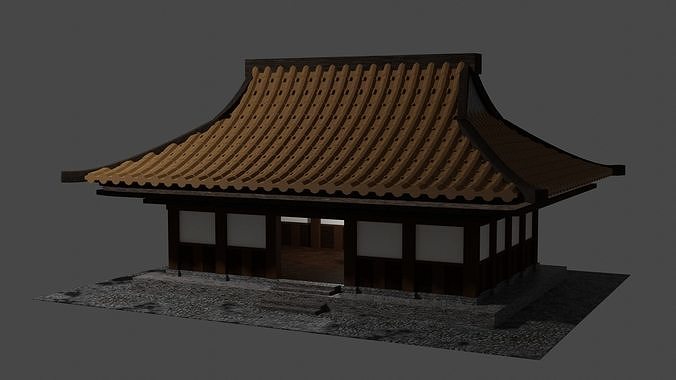
Locate an element on the screen. door is located at coordinates (311, 254).